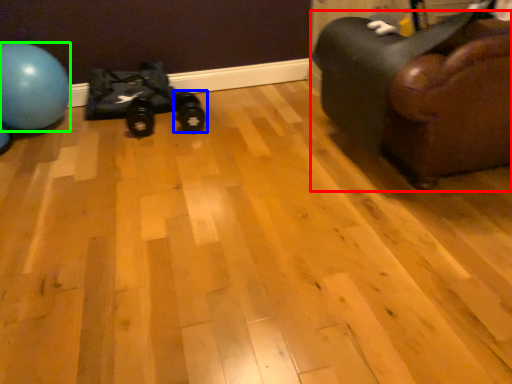
Question: Estimate the real-world distances between objects in this image. Which object is closer to furniture (highlighted by a red box), footwear (highlighted by a blue box) or ball (highlighted by a green box)?

Choices:
 (A) footwear
 (B) ball

Answer: (A)